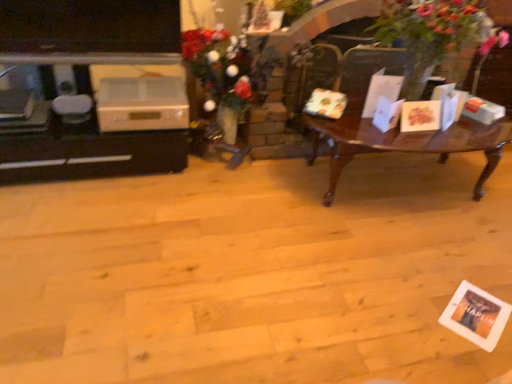
Question: Does white glossy entertainment center at left lie in front of white plastic appliance at left?

Choices:
 (A) no
 (B) yes

Answer: (B)

Question: Is white glossy entertainment center at left thinner than white plastic appliance at left?

Choices:
 (A) no
 (B) yes

Answer: (A)

Question: Can you confirm if white glossy entertainment center at left is positioned to the right of white plastic appliance at left?

Choices:
 (A) no
 (B) yes

Answer: (A)

Question: Are white glossy entertainment center at left and white plastic appliance at left far apart?

Choices:
 (A) yes
 (B) no

Answer: (B)

Question: Does white glossy entertainment center at left have a greater width compared to white plastic appliance at left?

Choices:
 (A) yes
 (B) no

Answer: (A)

Question: From a real-world perspective, is white plastic appliance at left physically located above or below green leafy plant at right?

Choices:
 (A) above
 (B) below

Answer: (B)

Question: Considering the positions of white plastic appliance at left and green leafy plant at right in the image, is white plastic appliance at left taller or shorter than green leafy plant at right?

Choices:
 (A) tall
 (B) short

Answer: (B)

Question: In terms of width, does white plastic appliance at left look wider or thinner when compared to green leafy plant at right?

Choices:
 (A) wide
 (B) thin

Answer: (B)

Question: Is point (141, 104) closer or farther from the camera than point (414, 26)?

Choices:
 (A) closer
 (B) farther

Answer: (B)

Question: Is floral bouquet at center taller or shorter than white plastic appliance at left?

Choices:
 (A) tall
 (B) short

Answer: (A)

Question: Considering the positions of floral bouquet at center and white plastic appliance at left in the image, is floral bouquet at center bigger or smaller than white plastic appliance at left?

Choices:
 (A) small
 (B) big

Answer: (B)

Question: Is point (218, 119) positioned closer to the camera than point (181, 96)?

Choices:
 (A) farther
 (B) closer

Answer: (A)

Question: From the image's perspective, is floral bouquet at center above or below white plastic appliance at left?

Choices:
 (A) below
 (B) above

Answer: (B)

Question: In terms of size, does green leafy plant at right appear bigger or smaller than white glossy entertainment center at left?

Choices:
 (A) small
 (B) big

Answer: (B)

Question: Is point (409, 94) positioned closer to the camera than point (33, 139)?

Choices:
 (A) closer
 (B) farther

Answer: (B)